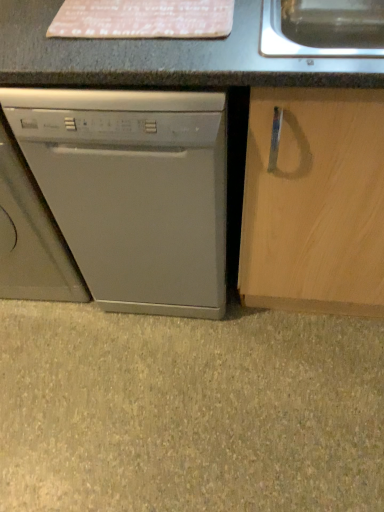
The image size is (384, 512). Identify the location of free location above gray matte dishwasher at lower left (from a real-world perspective). (184, 383).